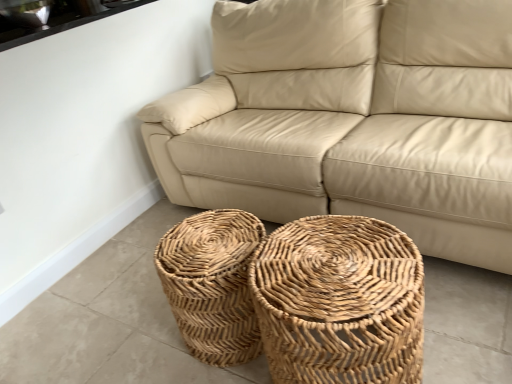
Identify the location of empty space that is ontop of natural woven basket at center, the 1th basket viewed from the right (from a real-world perspective). (334, 263).